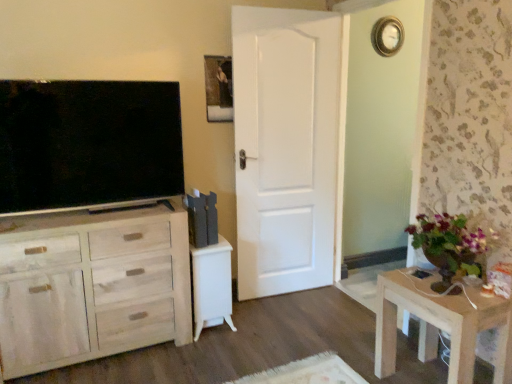
Question: Is gold-toned metallic clock at upper right aimed at white glossy vanity at center?

Choices:
 (A) no
 (B) yes

Answer: (A)

Question: Is gold-toned metallic clock at upper right further to camera compared to white glossy vanity at center?

Choices:
 (A) no
 (B) yes

Answer: (B)

Question: Does gold-toned metallic clock at upper right have a lesser height compared to white glossy vanity at center?

Choices:
 (A) no
 (B) yes

Answer: (B)

Question: Considering the relative sizes of gold-toned metallic clock at upper right and white glossy vanity at center in the image provided, is gold-toned metallic clock at upper right bigger than white glossy vanity at center?

Choices:
 (A) yes
 (B) no

Answer: (B)

Question: Is gold-toned metallic clock at upper right next to white glossy vanity at center?

Choices:
 (A) yes
 (B) no

Answer: (B)

Question: Looking at the image, does wooden picture frame at upper center seem bigger or smaller compared to wooden table at lower right?

Choices:
 (A) small
 (B) big

Answer: (A)

Question: In the image, is wooden picture frame at upper center on the left side or the right side of wooden table at lower right?

Choices:
 (A) left
 (B) right

Answer: (A)

Question: In the image, is wooden picture frame at upper center positioned in front of or behind wooden table at lower right?

Choices:
 (A) front
 (B) behind

Answer: (B)

Question: Is point (224, 71) closer or farther from the camera than point (493, 380)?

Choices:
 (A) closer
 (B) farther

Answer: (B)

Question: Is gold-toned metallic clock at upper right spatially inside white glossy vanity at center, or outside of it?

Choices:
 (A) inside
 (B) outside

Answer: (B)

Question: Is gold-toned metallic clock at upper right taller or shorter than white glossy vanity at center?

Choices:
 (A) short
 (B) tall

Answer: (A)

Question: Considering the positions of point click(x=391, y=41) and point click(x=215, y=246), is point click(x=391, y=41) closer or farther from the camera than point click(x=215, y=246)?

Choices:
 (A) closer
 (B) farther

Answer: (B)

Question: Would you say gold-toned metallic clock at upper right is to the left or to the right of white glossy vanity at center in the picture?

Choices:
 (A) right
 (B) left

Answer: (A)

Question: In the image, is white glossy vanity at center on the left side or the right side of light wood cabinet at left?

Choices:
 (A) left
 (B) right

Answer: (B)

Question: From a real-world perspective, relative to light wood cabinet at left, is white glossy vanity at center vertically above or below?

Choices:
 (A) above
 (B) below

Answer: (B)